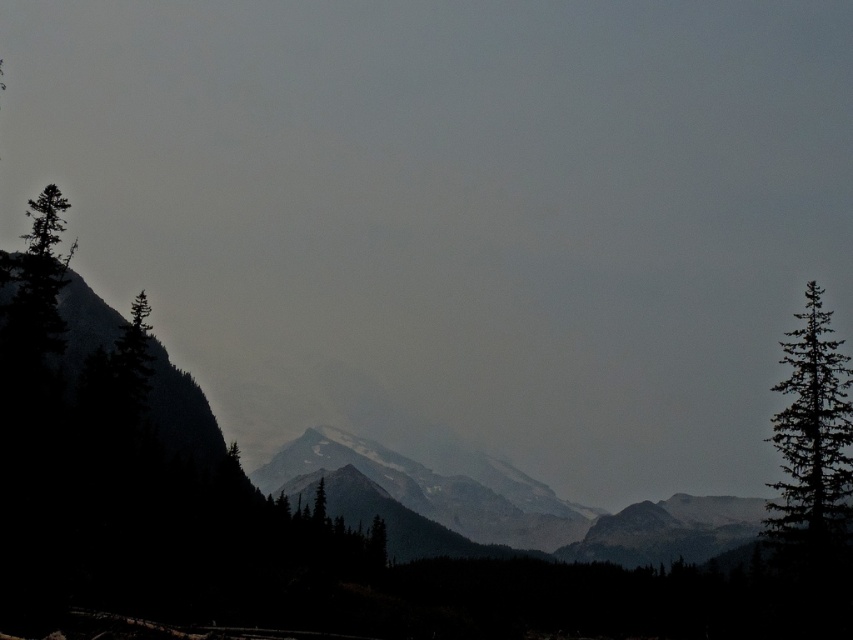
In the scene shown: You are standing at the origin point in the image. Which of the two points, point (421, 536) or point (323, 515), is farther away from you?

Point (421, 536) is farther away from you because it is positioned behind point (323, 515).

Based on the coordinates provided, what does the point at (498, 508) in the image represent?

The point at (498, 508) indicates the snowy granite mountain range at center.

You are a hiker planning to take a photo of the snowy granite mountain range at center and the green matte tree at left. Which object should you focus on first if you want to capture both in a single frame without moving the camera?

The snowy granite mountain range at center is much taller than the green matte tree at left, so you should focus on the snowy granite mountain range at center first to ensure it fills the frame appropriately before adjusting for the tree.